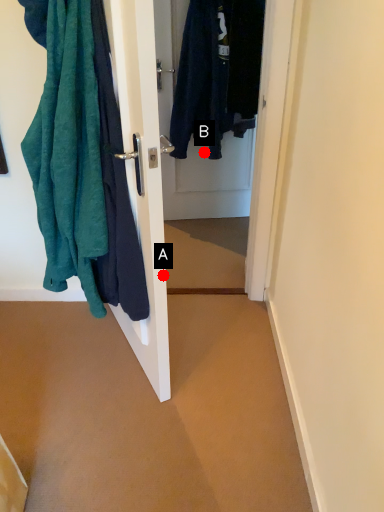
Question: Two points are circled on the image, labeled by A and B beside each circle. Which point is farther to the camera?

Choices:
 (A) A is further
 (B) B is further

Answer: (B)